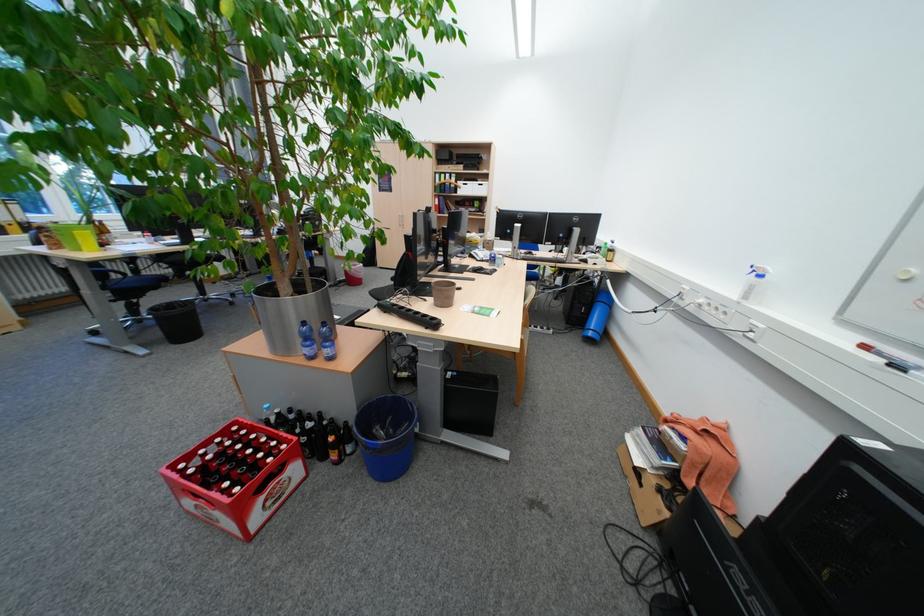
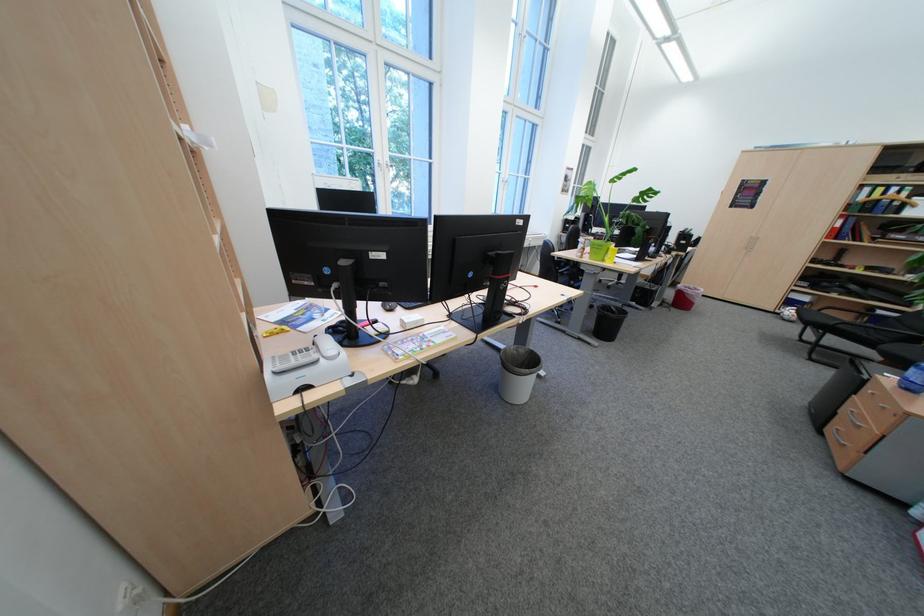
The point at [455,177] is marked in the first image. Where is the corresponding point in the second image?

(893, 190)